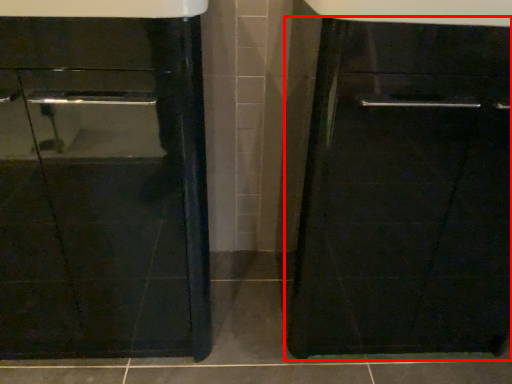
Question: Observing the image, what is the correct spatial positioning of cabinetry (annotated by the red box) in reference to sink?

Choices:
 (A) left
 (B) right

Answer: (B)